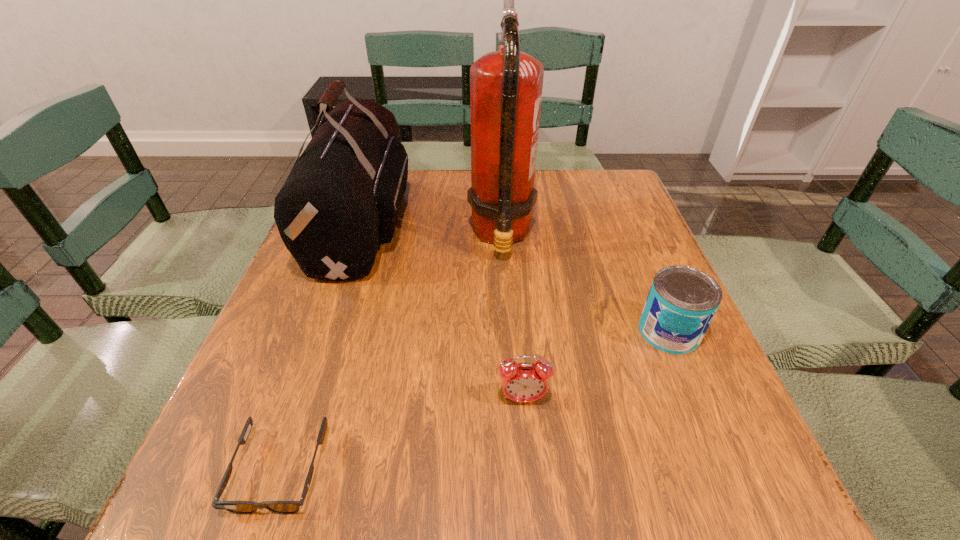
You are a GUI agent. You are given a task and a screenshot of the screen. Output one action in this format:
    pyautogui.click(x=<x>, y=<y>)
    Task: Click on the free space that satisfies the following two spatial constraints: 1. on the front pocket of the fourth shortest object; 2. on the right side of the can
    
    Given the screenshot: What is the action you would take?
    pyautogui.click(x=326, y=332)

The image size is (960, 540). Find the location of `free space that satisfies the following two spatial constraints: 1. at the nozzle of the fire extinguisher; 2. on the temples of the shortest object`. free space that satisfies the following two spatial constraints: 1. at the nozzle of the fire extinguisher; 2. on the temples of the shortest object is located at coordinates (516, 470).

Where is `vacant space that satisfies the following two spatial constraints: 1. at the nozzle of the tallest object; 2. on the temples of the nearest object`? vacant space that satisfies the following two spatial constraints: 1. at the nozzle of the tallest object; 2. on the temples of the nearest object is located at coordinates (516, 470).